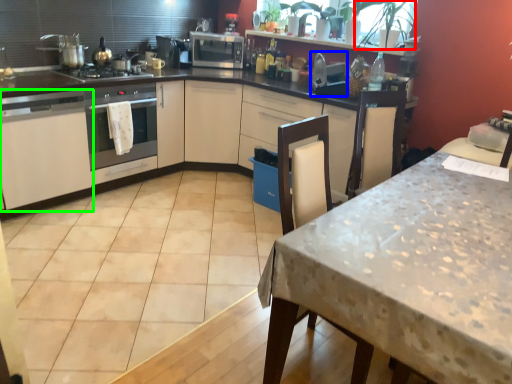
Question: Considering the real-world distances, which object is farthest from plant (highlighted by a red box)? appliance (highlighted by a blue box) or cabinetry (highlighted by a green box)?

Choices:
 (A) appliance
 (B) cabinetry

Answer: (B)